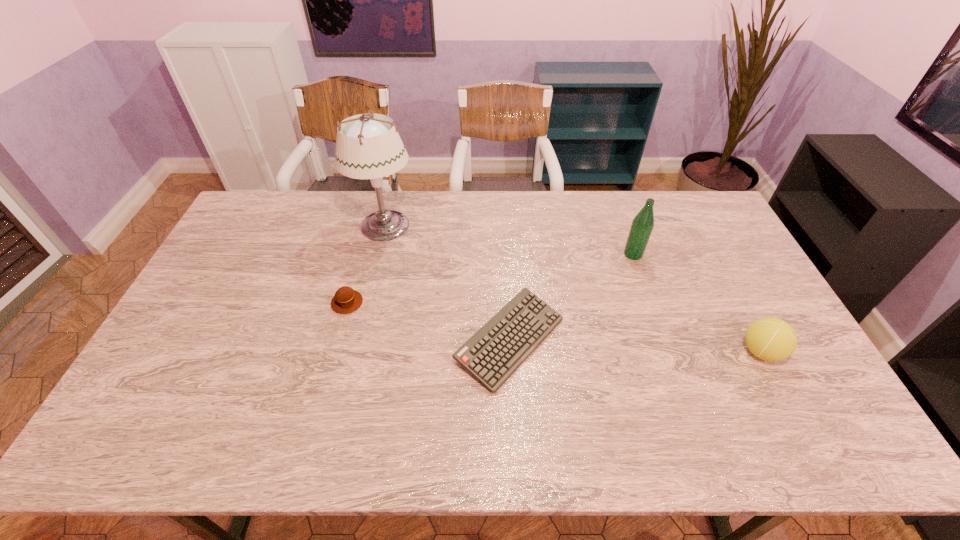
At what (x,y) coordinates should I click in order to perform the action: click on vacant space that satisfies the following two spatial constraints: 1. on the front side of the tennis ball; 2. on the right side of the computer keyboard. Please return your answer as a coordinate pair (x, y). This screenshot has height=540, width=960. Looking at the image, I should click on (511, 352).

Find the location of a particular element. This screenshot has height=540, width=960. vacant region that satisfies the following two spatial constraints: 1. on the lampshade of the tallest object; 2. on the right side of the third shortest object is located at coordinates (355, 352).

You are a GUI agent. You are given a task and a screenshot of the screen. Output one action in this format:
    pyautogui.click(x=<x>, y=<y>)
    Task: Click on the vacant area in the image that satisfies the following two spatial constraints: 1. on the lampshade of the rightmost object; 2. on the right side of the lampshade
    This screenshot has height=540, width=960.
    Given the screenshot: What is the action you would take?
    pyautogui.click(x=355, y=352)

The image size is (960, 540). I want to click on vacant region that satisfies the following two spatial constraints: 1. on the lampshade of the tallest object; 2. on the back side of the shortest object, so click(x=358, y=341).

Where is `vacant space that satisfies the following two spatial constraints: 1. on the lampshade of the computer keyboard; 2. on the right side of the lampshade`? vacant space that satisfies the following two spatial constraints: 1. on the lampshade of the computer keyboard; 2. on the right side of the lampshade is located at coordinates (358, 341).

Where is `free location that satisfies the following two spatial constraints: 1. on the back side of the muffin; 2. on the left side of the fourth object from left to right`? This screenshot has width=960, height=540. free location that satisfies the following two spatial constraints: 1. on the back side of the muffin; 2. on the left side of the fourth object from left to right is located at coordinates (361, 254).

Locate an element on the screen. This screenshot has height=540, width=960. blank area in the image that satisfies the following two spatial constraints: 1. on the lampshade of the tallest object; 2. on the back side of the shortest object is located at coordinates (358, 341).